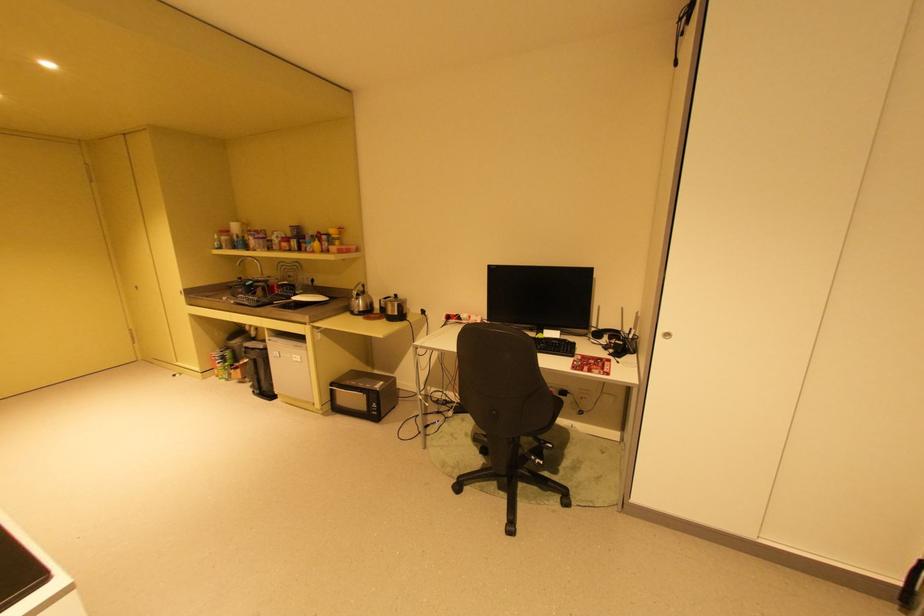
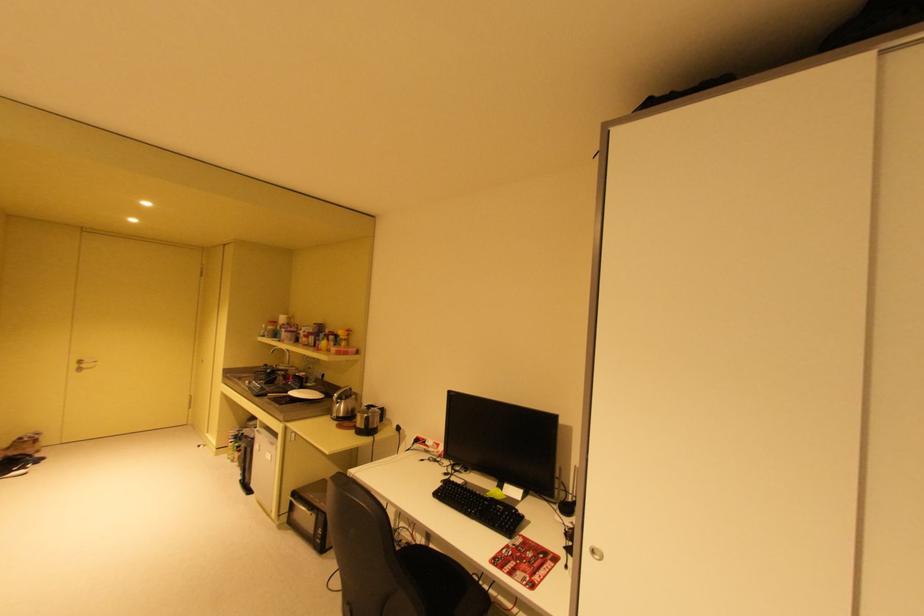
Which direction would the cameraman need to move to produce the second image?

The cameraman moved toward right, forward.